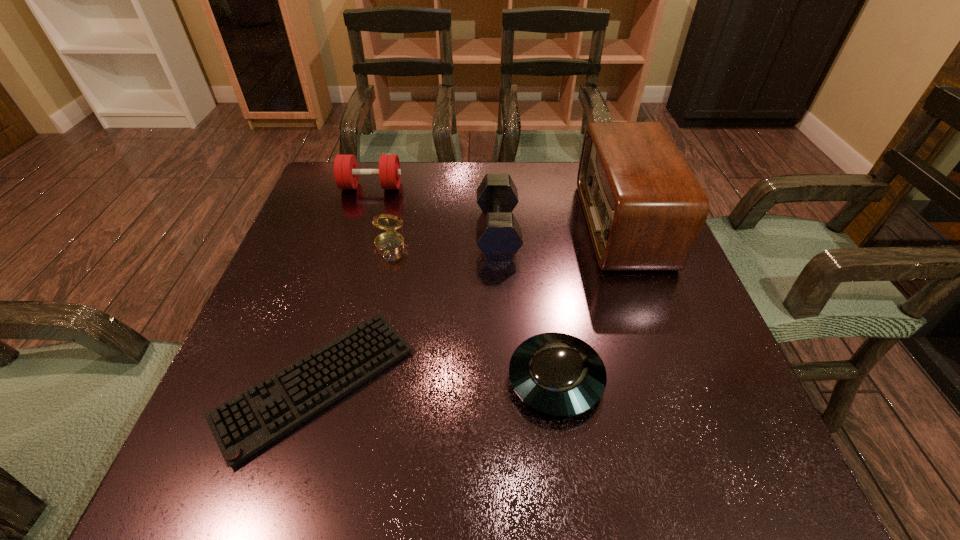
The width and height of the screenshot is (960, 540). What are the coordinates of `object at the far left corner` in the screenshot? It's located at (346, 173).

At what (x,y) coordinates should I click in order to perform the action: click on object located at the near left corner. Please return your answer as a coordinate pair (x, y). Image resolution: width=960 pixels, height=540 pixels. Looking at the image, I should click on (243, 425).

Identify the location of object present at the far right corner. This screenshot has width=960, height=540. (644, 208).

What are the coordinates of `vacant space at the far edge` in the screenshot? It's located at (434, 203).

The width and height of the screenshot is (960, 540). What are the coordinates of `vacant space at the near edge of the desktop` in the screenshot? It's located at (444, 438).

You are a GUI agent. You are given a task and a screenshot of the screen. Output one action in this format:
    pyautogui.click(x=<x>, y=<y>)
    Task: Click on the free space at the left edge of the desktop
    The height and width of the screenshot is (540, 960).
    Given the screenshot: What is the action you would take?
    pyautogui.click(x=363, y=234)

Where is `vacant point at the right edge`? vacant point at the right edge is located at coordinates (665, 421).

Image resolution: width=960 pixels, height=540 pixels. I want to click on empty space between the farther dumbbell and the fifth tallest object, so click(x=464, y=283).

The image size is (960, 540). In order to click on free space between the computer keyboard and the nearer dumbbell in this screenshot , I will do `click(407, 307)`.

You are a GUI agent. You are given a task and a screenshot of the screen. Output one action in this format:
    pyautogui.click(x=<x>, y=<y>)
    Task: Click on the free space between the right dumbbell and the tallest object
    This screenshot has width=960, height=540.
    Given the screenshot: What is the action you would take?
    pyautogui.click(x=560, y=228)